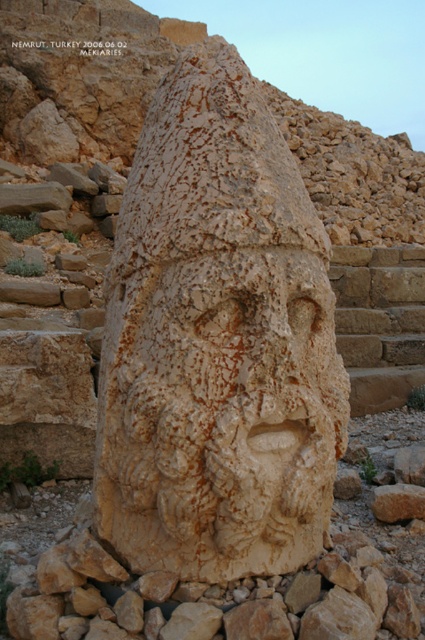
Question: Which point appears farthest from the camera in this image?

Choices:
 (A) (190, 116)
 (B) (340, 275)
 (C) (17, 44)

Answer: (C)

Question: Is beige stone sculpture at center to the right of brown stone stairs at center from the viewer's perspective?

Choices:
 (A) yes
 (B) no

Answer: (B)

Question: Where is beige stone sculpture at center located in relation to brown stone stairs at center in the image?

Choices:
 (A) left
 (B) right

Answer: (A)

Question: Is beige stone sculpture at center closer to camera compared to brown stone stairs at center?

Choices:
 (A) yes
 (B) no

Answer: (A)

Question: Which point appears closest to the camera in this image?

Choices:
 (A) (274, 401)
 (B) (371, 253)
 (C) (48, 40)

Answer: (A)

Question: Among these objects, which one is farthest from the camera?

Choices:
 (A) beige stone sculpture at center
 (B) brown stone stairs at center
 (C) black text at upper center

Answer: (C)